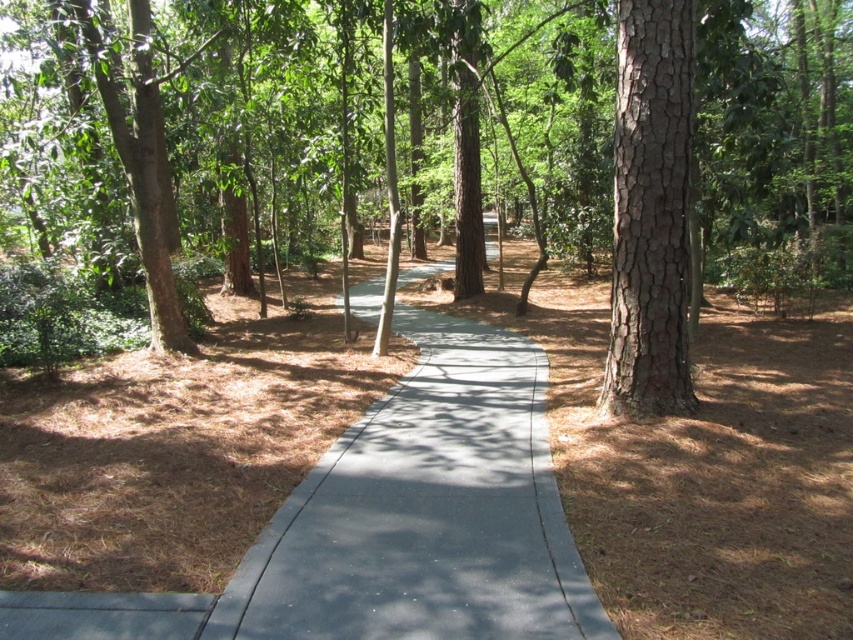
Question: Which point is closer to the camera?

Choices:
 (A) (515, 49)
 (B) (624, 134)
 (C) (503, 561)

Answer: (C)

Question: Where is brown rough tree trunk at center located in relation to brown rough bark tree at right in the image?

Choices:
 (A) above
 (B) below

Answer: (A)

Question: Which point is farther from the camera taking this photo?

Choices:
 (A) (463, 346)
 (B) (811, 220)

Answer: (B)

Question: Is gray concrete trail at center smaller than brown rough bark tree at right?

Choices:
 (A) yes
 (B) no

Answer: (B)

Question: Can you confirm if brown rough tree trunk at center is positioned below gray concrete trail at center?

Choices:
 (A) no
 (B) yes

Answer: (A)

Question: Which point is farther to the camera?

Choices:
 (A) (810, 10)
 (B) (456, 381)

Answer: (A)